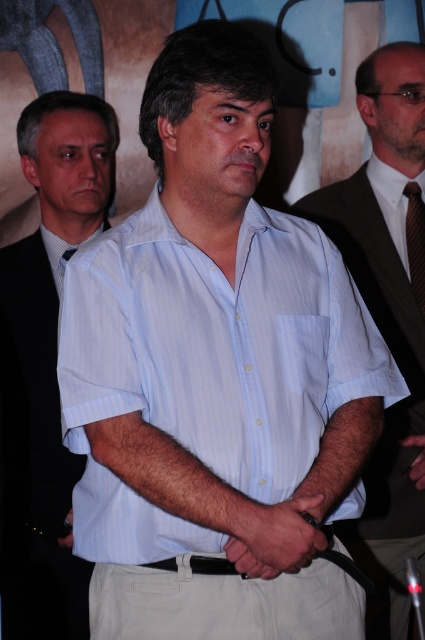
Question: From the image, what is the correct spatial relationship of light blue striped shirt at center in relation to black leather hand at center?

Choices:
 (A) below
 (B) above

Answer: (B)

Question: Which object is closer to the camera taking this photo?

Choices:
 (A) blue striped tie at center
 (B) black leather belt at lower left
 (C) brown textured tie at center-right
 (D) white striped shirt at center

Answer: (B)

Question: Does smooth skin hands at center appear on the left side of brown textured tie at center-right?

Choices:
 (A) no
 (B) yes

Answer: (B)

Question: Which of the following is the farthest from the observer?

Choices:
 (A) white striped shirt at center
 (B) blue striped tie at center
 (C) black leather hand at center

Answer: (B)

Question: Which object is positioned closest to the black leather hand at center?

Choices:
 (A) brown textured tie at center-right
 (B) smooth skin hands at center
 (C) blue striped tie at center
 (D) white striped shirt at center

Answer: (A)

Question: Is brown textured tie at center-right to the right of black leather belt at lower left from the viewer's perspective?

Choices:
 (A) yes
 (B) no

Answer: (A)